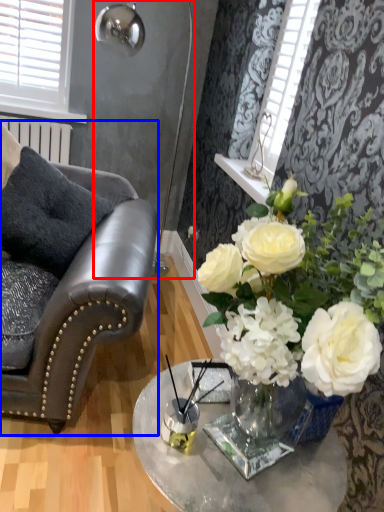
Question: Which object is closer to the camera taking this photo, lamp (highlighted by a red box) or chair (highlighted by a blue box)?

Choices:
 (A) lamp
 (B) chair

Answer: (B)